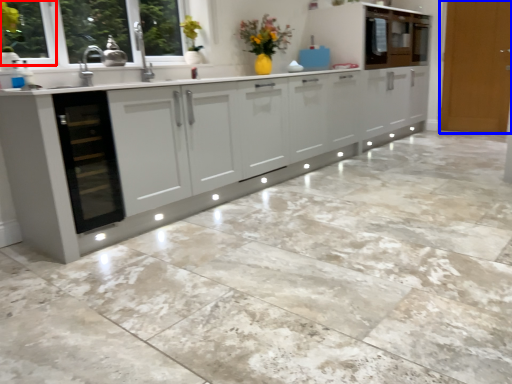
Question: Which point is further to the camera, window frame (highlighted by a red box) or door (highlighted by a blue box)?

Choices:
 (A) window frame
 (B) door

Answer: (B)